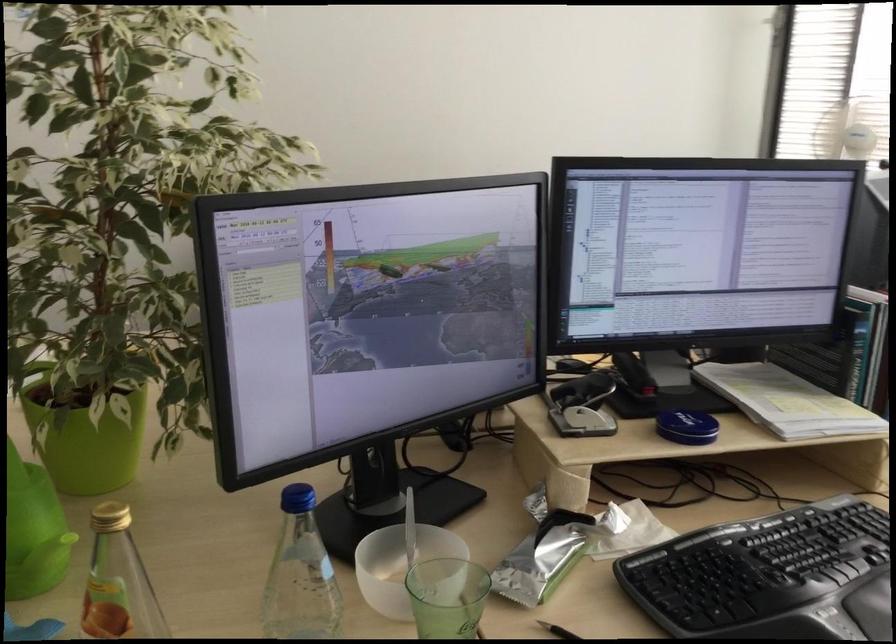
Find the location of a particular element. The height and width of the screenshot is (644, 896). hole punch lever is located at coordinates (583, 391).